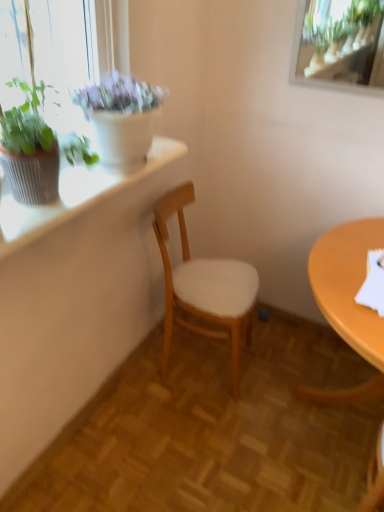
Question: Does textured white window sill at upper left have a larger size compared to white woven wood chair at center?

Choices:
 (A) no
 (B) yes

Answer: (A)

Question: Could white woven wood chair at center be considered to be inside textured white window sill at upper left?

Choices:
 (A) no
 (B) yes

Answer: (A)

Question: From a real-world perspective, is textured white window sill at upper left beneath white woven wood chair at center?

Choices:
 (A) yes
 (B) no

Answer: (B)

Question: Considering the relative positions of textured white window sill at upper left and white woven wood chair at center in the image provided, is textured white window sill at upper left to the right of white woven wood chair at center from the viewer's perspective?

Choices:
 (A) yes
 (B) no

Answer: (B)

Question: Considering the relative sizes of textured white window sill at upper left and white woven wood chair at center in the image provided, is textured white window sill at upper left wider than white woven wood chair at center?

Choices:
 (A) yes
 (B) no

Answer: (B)

Question: Is textured white window sill at upper left with white woven wood chair at center?

Choices:
 (A) no
 (B) yes

Answer: (A)

Question: From a real-world perspective, is matte white pot at upper left, the 1th houseplant in the back-to-front sequence, positioned over green leafy plant at upper left, which is counted as the 2th houseplant, starting from the back, based on gravity?

Choices:
 (A) yes
 (B) no

Answer: (B)

Question: Considering the relative positions of matte white pot at upper left, the 1th houseplant in the back-to-front sequence, and green leafy plant at upper left, placed as the 1th houseplant when sorted from front to back, in the image provided, is matte white pot at upper left, the 1th houseplant in the back-to-front sequence, to the right of green leafy plant at upper left, placed as the 1th houseplant when sorted from front to back, from the viewer's perspective?

Choices:
 (A) no
 (B) yes

Answer: (B)

Question: Is matte white pot at upper left, the 1th houseplant in the back-to-front sequence, at the left side of green leafy plant at upper left, which is counted as the 2th houseplant, starting from the back?

Choices:
 (A) yes
 (B) no

Answer: (B)

Question: Is matte white pot at upper left, the 1th houseplant in the back-to-front sequence, not inside green leafy plant at upper left, which is counted as the 2th houseplant, starting from the back?

Choices:
 (A) yes
 (B) no

Answer: (A)

Question: From the image's perspective, does matte white pot at upper left, the 2th houseplant in the front-to-back sequence, appear higher than green leafy plant at upper left, placed as the 1th houseplant when sorted from front to back?

Choices:
 (A) no
 (B) yes

Answer: (B)

Question: Can you confirm if matte white pot at upper left, the 1th houseplant in the back-to-front sequence, is shorter than green leafy plant at upper left, placed as the 1th houseplant when sorted from front to back?

Choices:
 (A) no
 (B) yes

Answer: (B)

Question: Considering the relative sizes of green leafy plant at upper left, which is counted as the 2th houseplant, starting from the back, and white woven wood chair at center in the image provided, is green leafy plant at upper left, which is counted as the 2th houseplant, starting from the back, taller than white woven wood chair at center?

Choices:
 (A) yes
 (B) no

Answer: (B)